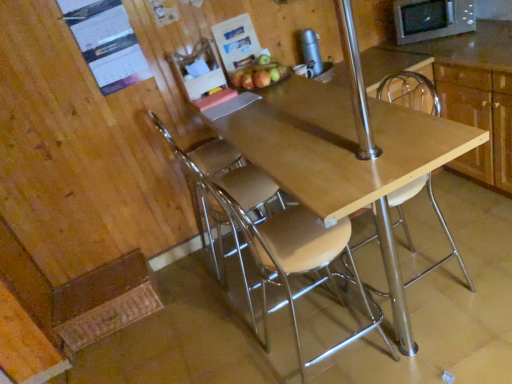
Question: Is wooden seat at center, which appears as the 2th chair when viewed from the right, in contact with wooden cabinet at upper right?

Choices:
 (A) yes
 (B) no

Answer: (B)

Question: Does wooden seat at center, which appears as the 2th chair when viewed from the right, have a lesser width compared to wooden cabinet at upper right?

Choices:
 (A) no
 (B) yes

Answer: (B)

Question: Is wooden seat at center, which is the 2th chair from left to right, behind wooden cabinet at upper right?

Choices:
 (A) yes
 (B) no

Answer: (B)

Question: Does wooden seat at center, which is the 2th chair from left to right, have a greater width compared to wooden cabinet at upper right?

Choices:
 (A) yes
 (B) no

Answer: (B)

Question: Would you say wooden seat at center, which appears as the 2th chair when viewed from the right, contains wooden cabinet at upper right?

Choices:
 (A) yes
 (B) no

Answer: (B)

Question: From the image's perspective, is wooden seat at center, which is the 2th chair from left to right, above or below light brown wood chair at center, which appears as the 1th chair when viewed from the right?

Choices:
 (A) below
 (B) above

Answer: (A)

Question: Is wooden seat at center, which is the 2th chair from left to right, to the left or to the right of light brown wood chair at center, which appears as the 1th chair when viewed from the right, in the image?

Choices:
 (A) left
 (B) right

Answer: (A)

Question: From a real-world perspective, relative to light brown wood chair at center, acting as the 3th chair starting from the left, is wooden seat at center, which appears as the 2th chair when viewed from the right, vertically above or below?

Choices:
 (A) above
 (B) below

Answer: (B)

Question: In terms of width, does wooden seat at center, which appears as the 2th chair when viewed from the right, look wider or thinner when compared to light brown wood chair at center, acting as the 3th chair starting from the left?

Choices:
 (A) wide
 (B) thin

Answer: (B)

Question: Does point (306, 33) appear closer or farther from the camera than point (217, 170)?

Choices:
 (A) farther
 (B) closer

Answer: (A)

Question: Do you think metallic silver thermos at upper center is within metallic silver chair at center, the first chair when ordered from left to right, or outside of it?

Choices:
 (A) outside
 (B) inside

Answer: (A)

Question: From the image's perspective, is metallic silver thermos at upper center positioned above or below metallic silver chair at center, the first chair when ordered from left to right?

Choices:
 (A) above
 (B) below

Answer: (A)

Question: Considering the relative positions of metallic silver thermos at upper center and metallic silver chair at center, the first chair when ordered from left to right, in the image provided, is metallic silver thermos at upper center to the left or to the right of metallic silver chair at center, the first chair when ordered from left to right,?

Choices:
 (A) right
 (B) left

Answer: (A)

Question: Is point (245, 86) positioned closer to the camera than point (507, 84)?

Choices:
 (A) closer
 (B) farther

Answer: (B)

Question: In the image, is shiny red apple at upper center on the left side or the right side of wooden cabinet at upper right?

Choices:
 (A) left
 (B) right

Answer: (A)